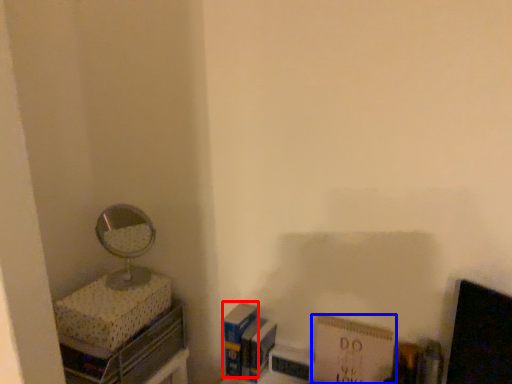
Question: Which of the following is the farthest to the observer, paperback book (highlighted by a red box) or paperback book (highlighted by a blue box)?

Choices:
 (A) paperback book
 (B) paperback book

Answer: (A)